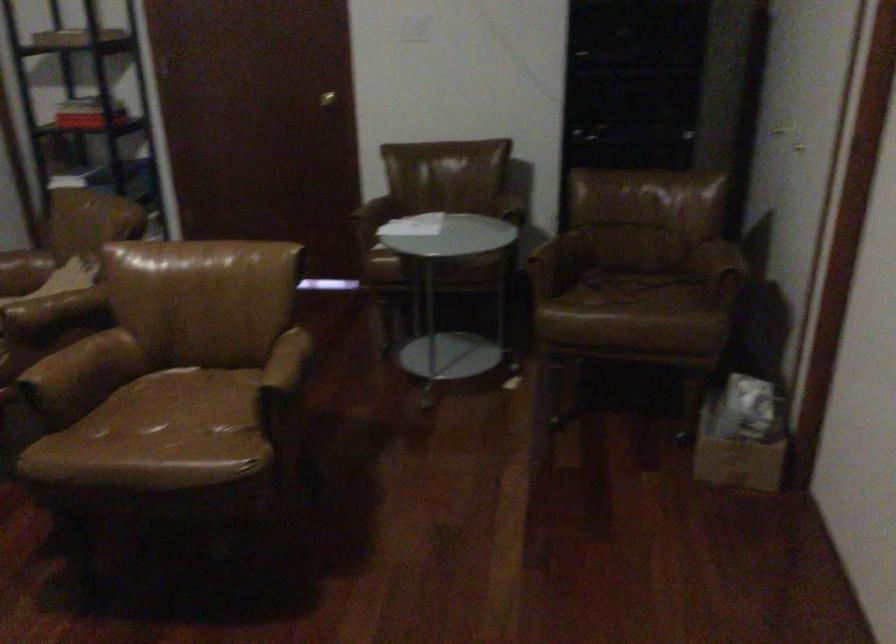
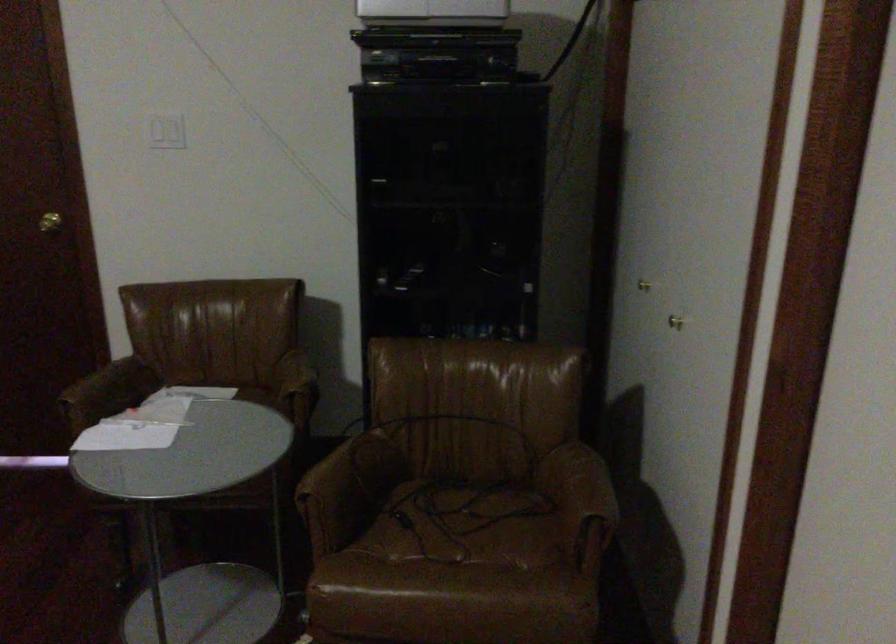
The point at (325, 96) is marked in the first image. Where is the corresponding point in the second image?

(49, 222)